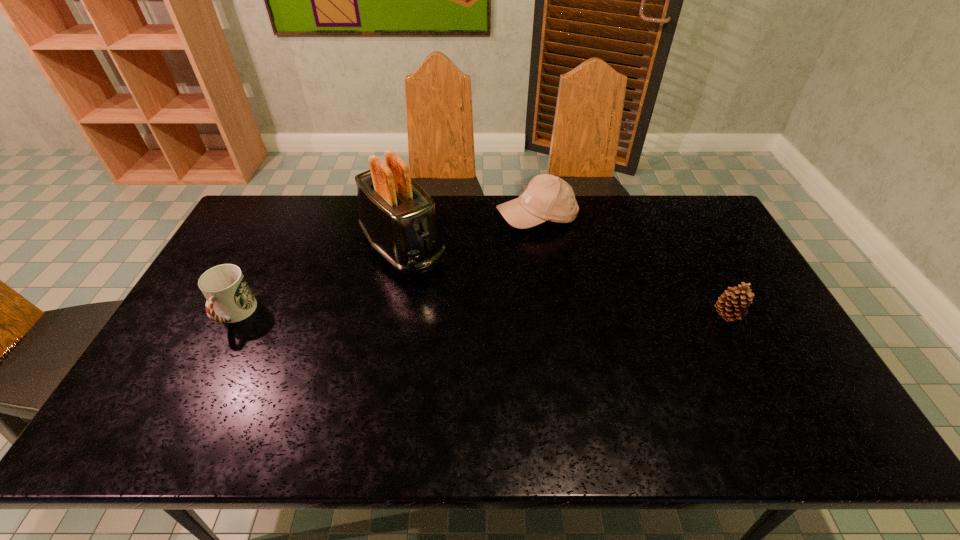
This screenshot has height=540, width=960. Identify the location of free space between the tallest object and the second object from right to left. (469, 232).

I want to click on vacant region between the third shortest object and the cup, so click(x=385, y=266).

The height and width of the screenshot is (540, 960). I want to click on free space between the second object from right to left and the leftmost object, so (385, 266).

Select which object appears as the third closest to the pinecone. Please provide its 2D coordinates. Your answer should be formatted as a tuple, i.e. [(x, y)], where the tuple contains the x and y coordinates of a point satisfying the conditions above.

[(229, 298)]

Find the location of a particular element. object that is the third closest to the cup is located at coordinates (734, 301).

Identify the location of free space that satisfies the following two spatial constraints: 1. on the side of the rightmost object where the handle is located; 2. on the right side of the leftmost object. (234, 315).

At what (x,y) coordinates should I click in order to perform the action: click on free spot that satisfies the following two spatial constraints: 1. on the back side of the second object from right to left; 2. on the left side of the third object from right to left. Please return your answer as a coordinate pair (x, y). Looking at the image, I should click on (408, 217).

Locate an element on the screen. The width and height of the screenshot is (960, 540). vacant space that satisfies the following two spatial constraints: 1. on the side of the pinecone where the handle is located; 2. on the left side of the leftmost object is located at coordinates (234, 315).